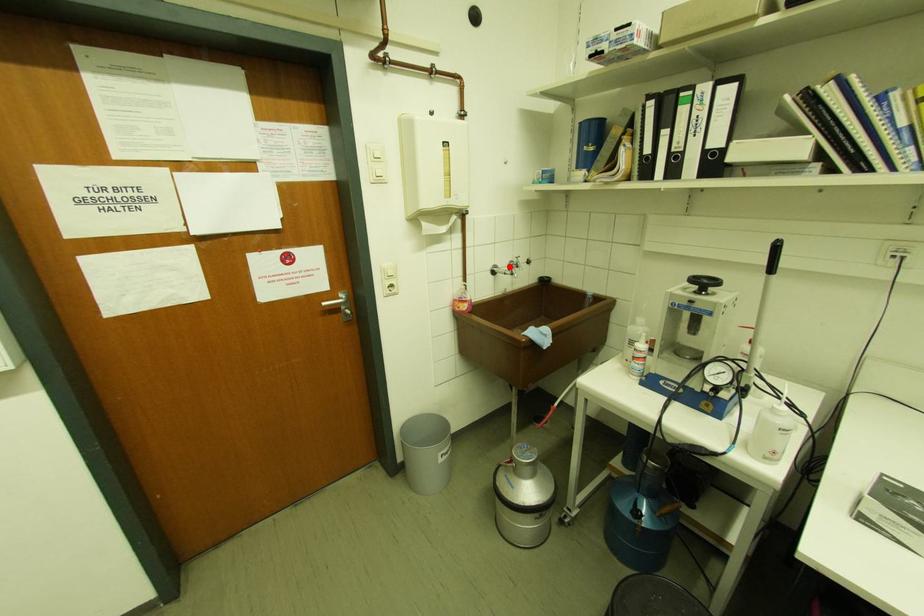
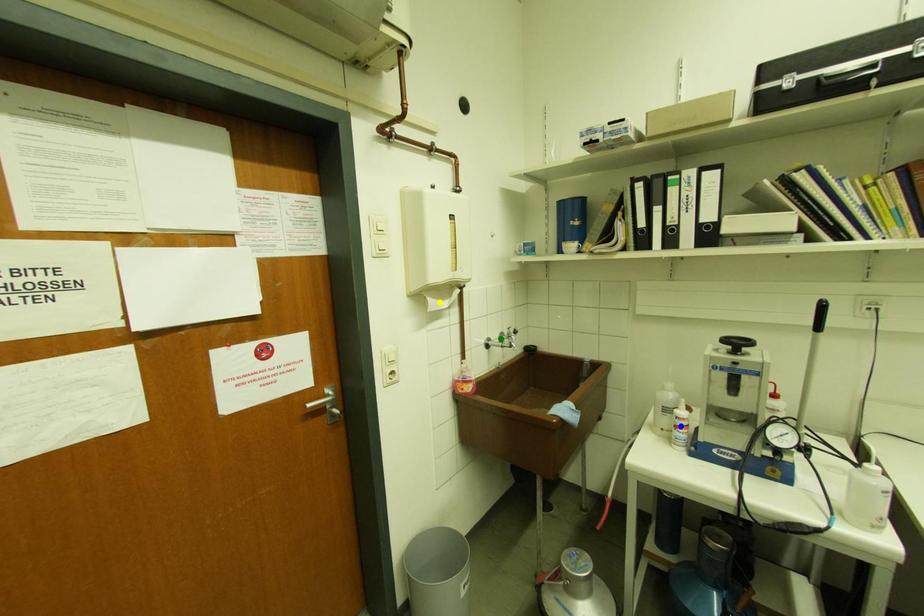
Question: I am providing you with two images of the same scene from different viewpoints. A red point is marked on the first image. You are given multiple points on the second image. In image 2, which mark is for the same physical point as the one in image 1?

Choices:
 (A) green point
 (B) yellow point
 (C) blue point

Answer: (A)